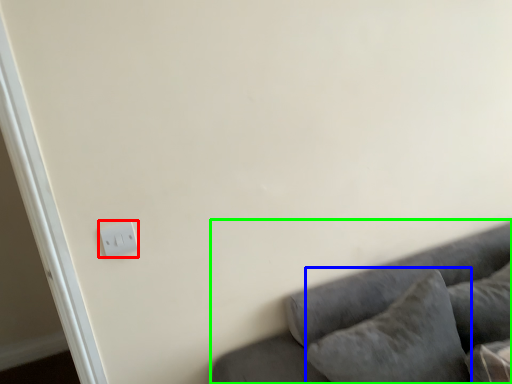
Question: Estimate the real-world distances between objects in this image. Which object is farther from light switch (highlighted by a red box), pillow (highlighted by a blue box) or studio couch (highlighted by a green box)?

Choices:
 (A) pillow
 (B) studio couch

Answer: (A)